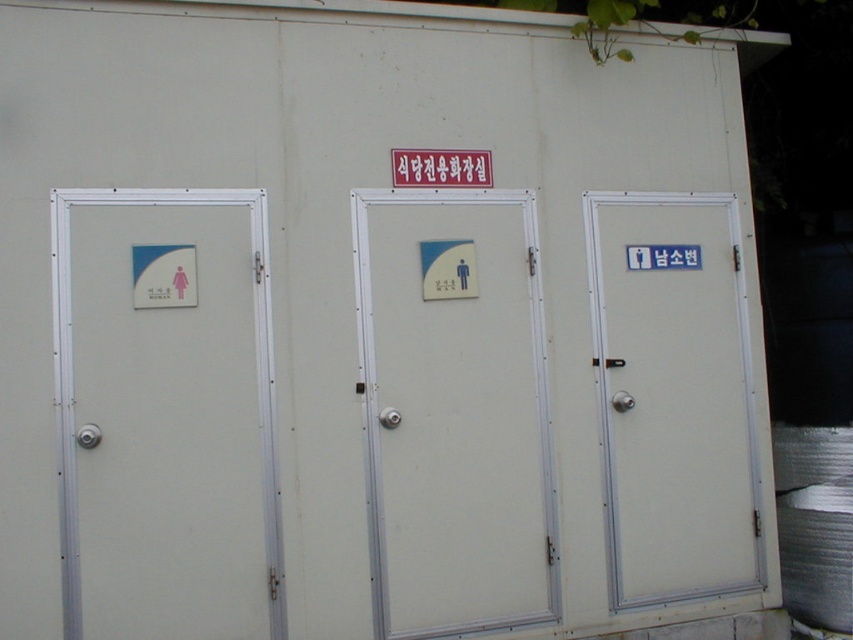
Does white matte door at left appear on the right side of white matte door at center?

In fact, white matte door at left is to the left of white matte door at center.

Can you confirm if white matte door at left is smaller than white matte door at center?

Correct, white matte door at left occupies less space than white matte door at center.

Locate an element on the screen. The height and width of the screenshot is (640, 853). white matte door at left is located at coordinates (165, 413).

Can you confirm if white matte door at left is bigger than white matte door at right?

Correct, white matte door at left is larger in size than white matte door at right.

Measure the distance between white matte door at left and white matte door at right.

29.23 inches

Which is in front, point (90, 301) or point (602, 333)?

Point (90, 301) is in front.

I want to click on white matte door at left, so click(165, 413).

Can you confirm if white matte door at center is positioned to the left of white plastic sign at center?

No, white matte door at center is not to the left of white plastic sign at center.

Between point (488, 250) and point (422, 176), which one is positioned in front?

Point (422, 176) is more forward.

Locate an element on the screen. Image resolution: width=853 pixels, height=640 pixels. white matte door at center is located at coordinates (454, 412).